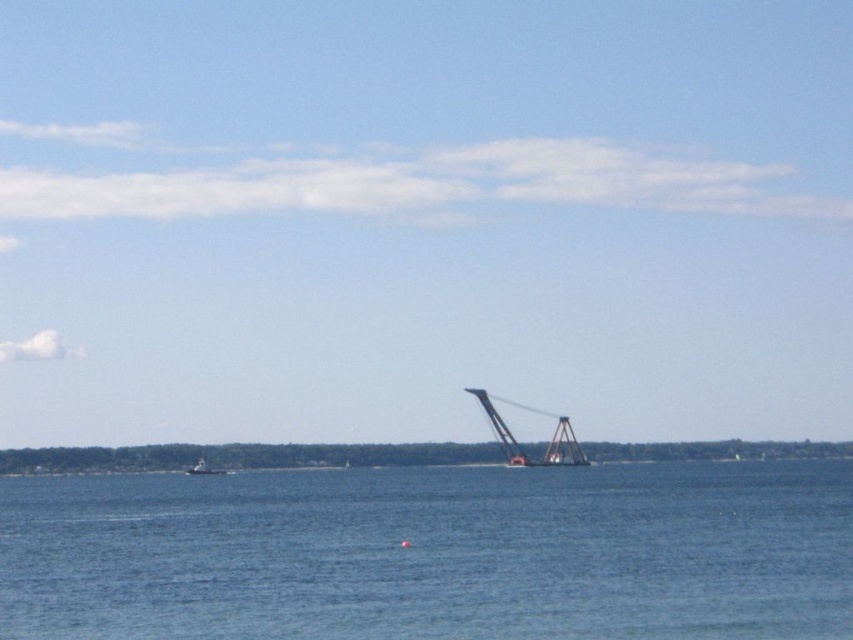
Is blue water at center bigger than metallic orange crane at center?

Yes.

Can you confirm if blue water at center is positioned above metallic orange crane at center?

Incorrect, blue water at center is not positioned above metallic orange crane at center.

Find the location of a particular element. blue water at center is located at coordinates (433, 554).

I want to click on blue water at center, so click(x=433, y=554).

Is metallic orange crane at center further to camera compared to white matte boat at lower left?

No, it is in front of white matte boat at lower left.

This screenshot has width=853, height=640. I want to click on metallic orange crane at center, so click(547, 444).

Between blue water at center and white matte boat at lower left, which one appears on the left side from the viewer's perspective?

From the viewer's perspective, white matte boat at lower left appears more on the left side.

Is blue water at center to the left of white matte boat at lower left from the viewer's perspective?

Incorrect, blue water at center is not on the left side of white matte boat at lower left.

Who is more distant from viewer, (799, 534) or (195, 472)?

Point (195, 472)

At what (x,y) coordinates should I click in order to perform the action: click on blue water at center. Please return your answer as a coordinate pair (x, y). The image size is (853, 640). Looking at the image, I should click on (433, 554).